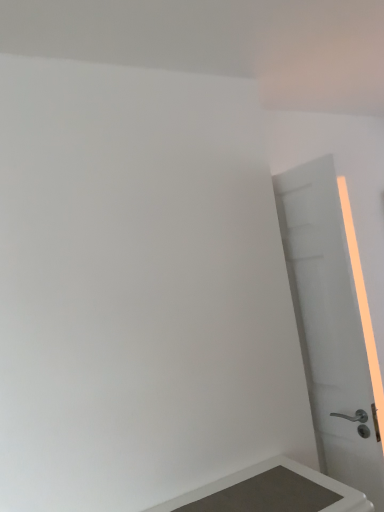
Identify the location of white matte door at right. (331, 323).

What do you see at coordinates (331, 323) in the screenshot? The image size is (384, 512). I see `white matte door at right` at bounding box center [331, 323].

This screenshot has height=512, width=384. What are the coordinates of `white matte door at right` in the screenshot? It's located at (331, 323).